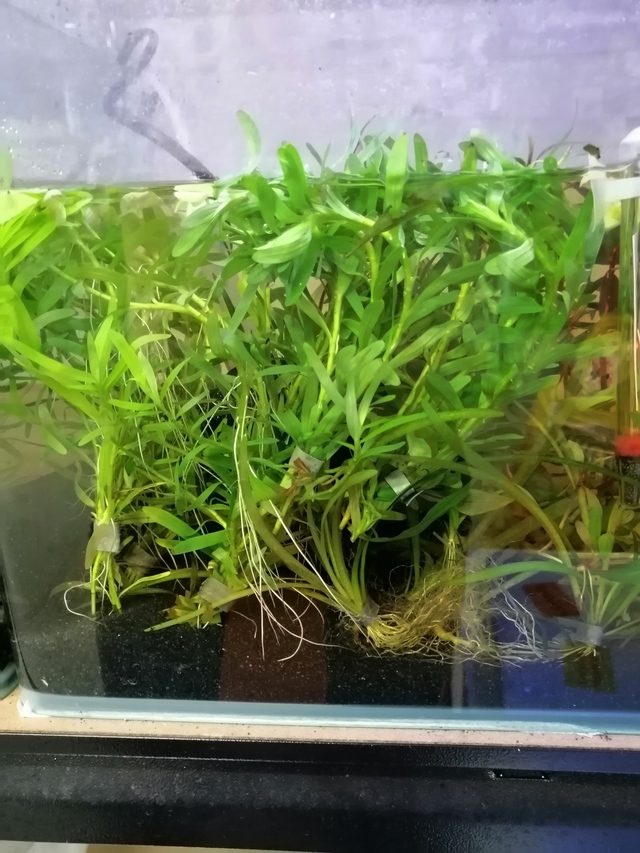
At what (x,y) coordinates should I click in order to perform the action: click on black table. Please return your answer as a coordinate pair (x, y). Looking at the image, I should click on (166, 741).